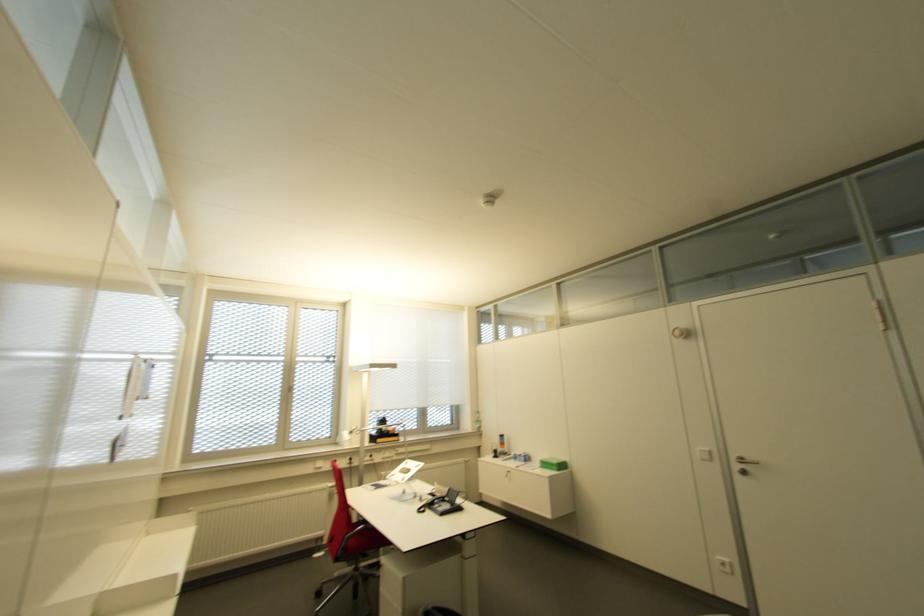
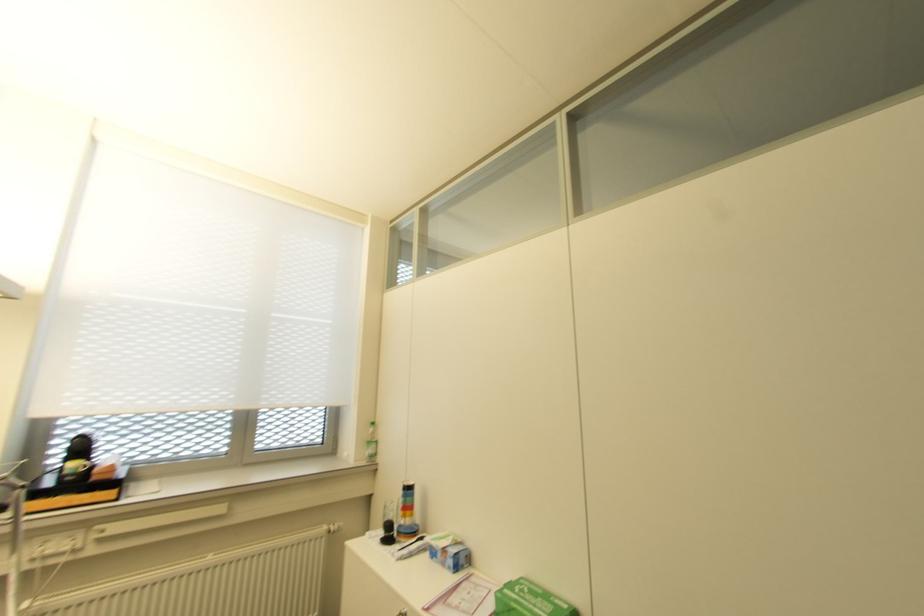
Question: I am providing you with two images of the same scene from different viewpoints. Please identify which objects are invisible in image2.

Choices:
 (A) black stamp object
 (B) green plastic bottle
 (C) blue and white box
 (D) none of these

Answer: (D)